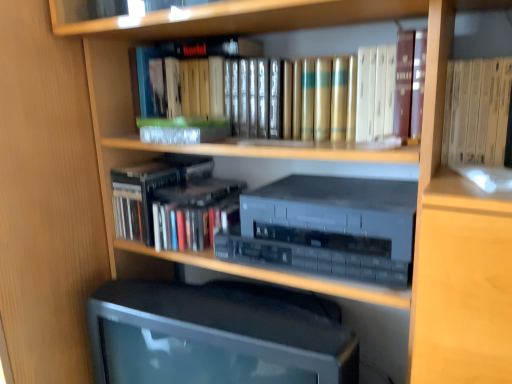
Question: Considering the relative sizes of matte black monitor at center and hardcover books at center, which appears as the first book when ordered from the bottom, in the image provided, is matte black monitor at center bigger than hardcover books at center, which appears as the first book when ordered from the bottom,?

Choices:
 (A) yes
 (B) no

Answer: (A)

Question: Is matte black monitor at center outside hardcover books at center, which ranks as the second book in top-to-bottom order?

Choices:
 (A) no
 (B) yes

Answer: (B)

Question: From the image's perspective, would you say matte black monitor at center is positioned over hardcover books at center, which ranks as the second book in top-to-bottom order?

Choices:
 (A) no
 (B) yes

Answer: (A)

Question: Is the position of matte black monitor at center more distant than that of hardcover books at center, which appears as the first book when ordered from the bottom?

Choices:
 (A) yes
 (B) no

Answer: (B)

Question: Is matte black monitor at center not near hardcover books at center, which ranks as the second book in top-to-bottom order?

Choices:
 (A) no
 (B) yes

Answer: (A)

Question: Is matte black monitor at center thinner than hardcover books at center, which ranks as the second book in top-to-bottom order?

Choices:
 (A) no
 (B) yes

Answer: (B)

Question: Can you confirm if satin silver stereo at center is thinner than hardcover books at center, which appears as the first book when ordered from the bottom?

Choices:
 (A) yes
 (B) no

Answer: (A)

Question: From the image's perspective, is satin silver stereo at center located beneath hardcover books at center, which ranks as the second book in top-to-bottom order?

Choices:
 (A) no
 (B) yes

Answer: (B)

Question: From the image's perspective, is satin silver stereo at center on hardcover books at center, which ranks as the second book in top-to-bottom order?

Choices:
 (A) yes
 (B) no

Answer: (B)

Question: Is satin silver stereo at center with hardcover books at center, which appears as the first book when ordered from the bottom?

Choices:
 (A) no
 (B) yes

Answer: (A)

Question: Is satin silver stereo at center at the left side of hardcover books at center, which ranks as the second book in top-to-bottom order?

Choices:
 (A) yes
 (B) no

Answer: (B)

Question: Can you confirm if satin silver stereo at center is shorter than hardcover books at center, which appears as the first book when ordered from the bottom?

Choices:
 (A) no
 (B) yes

Answer: (B)

Question: Is gold leather book at center, positioned as the second book in bottom-to-top order, to the left of matte black monitor at center from the viewer's perspective?

Choices:
 (A) yes
 (B) no

Answer: (B)